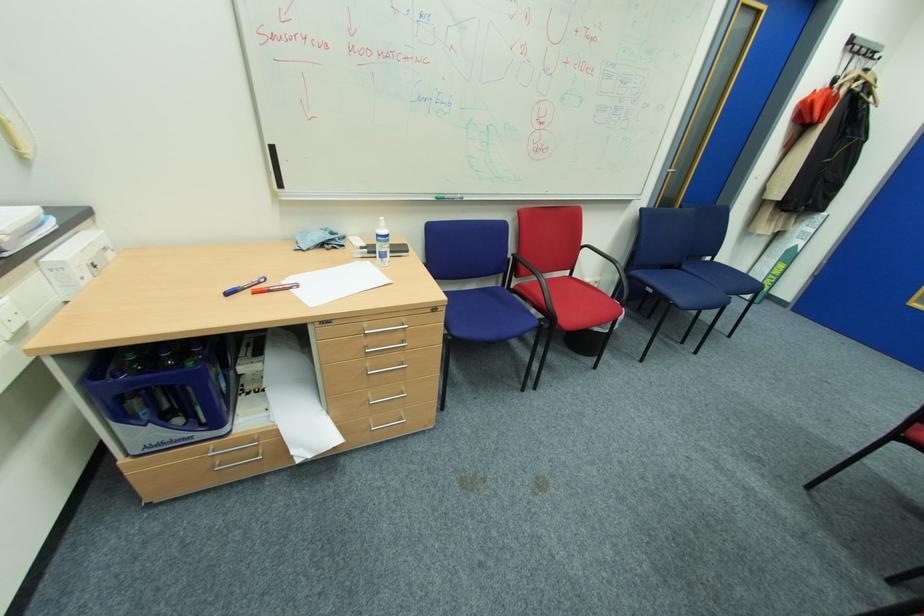
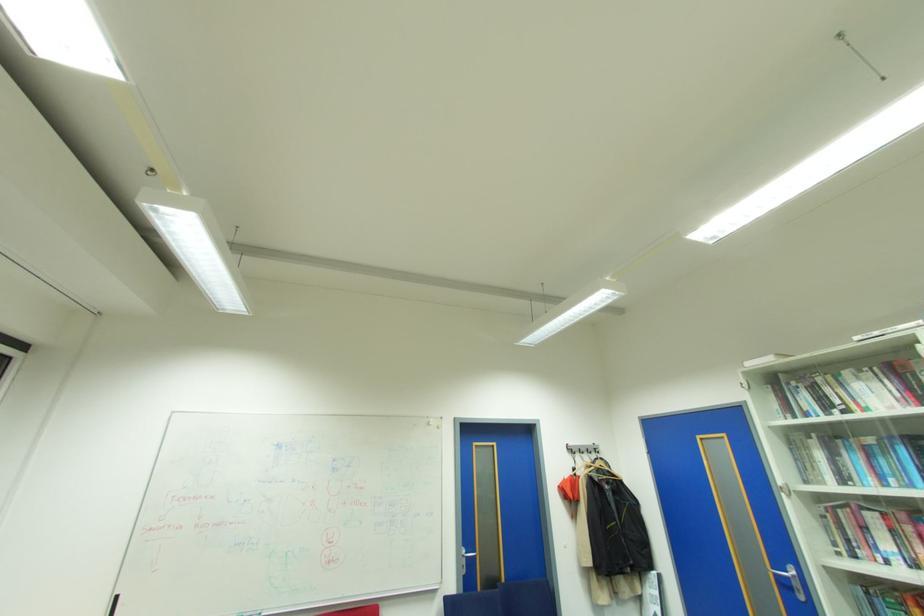
Where in the second image is the point corresponding to point 879,53 from the first image?

(600, 448)